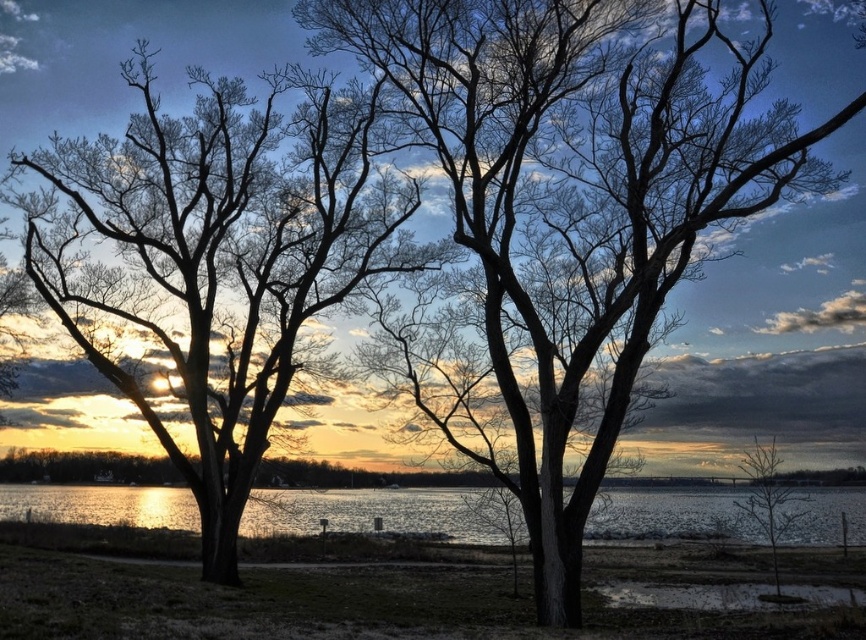
You are standing at the lakeside and want to take a photo of both the silhouette bark tree at center and the bare branches at lower right in the same frame. Your camera has a maximum focus range of 10 meters. Can you capture both objects in focus without moving your position?

The silhouette bark tree at center is 12.95 meters away from the bare branches at lower right. Since the distance between them exceeds the camera maximum focus range of 10 meters, you cannot capture both objects in focus without moving your position.

You are standing at the edge of the lake and want to locate the glistening water at center. According to the coordinates provided, in which direction should you look relative to your position?

The glistening water at center is located at coordinates point (x=372, y=513). Since the coordinates are given as x,y values, the x value of 0.802 indicates a position 80.2 percent from the left edge of the image to the right, and the y value of 0.431 indicates 43.1 percent from the bottom edge upwards. Therefore, you should look towards the lower right direction from your current position at the edge of the lake.